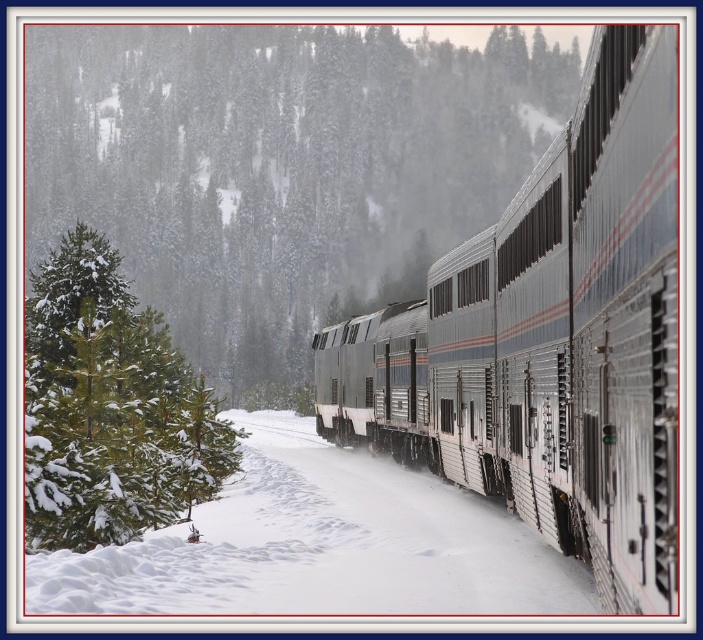
You are standing at the point closest to the train in this winter scene. There are two points marked on the ground, one at coordinates point (x=671, y=218) and another at point (x=148, y=408). Which point is closer to your current position?

Point (x=671, y=218) is in front of point (x=148, y=408), so it is closer to your current position near the train.

Based on the photo, you are standing at the origin point in the winter scene. There is a point labeled as point (278,168). What object does this point correspond to?

The point (278,168) corresponds to the green matte tree at left.

Consider the image. You are standing at point (x=413, y=611) and want to walk towards the train on the right side of the frame. Is the point (x=122, y=144) behind you or in front of you?

The point (x=122, y=144) is behind point (x=413, y=611), so it is behind you.